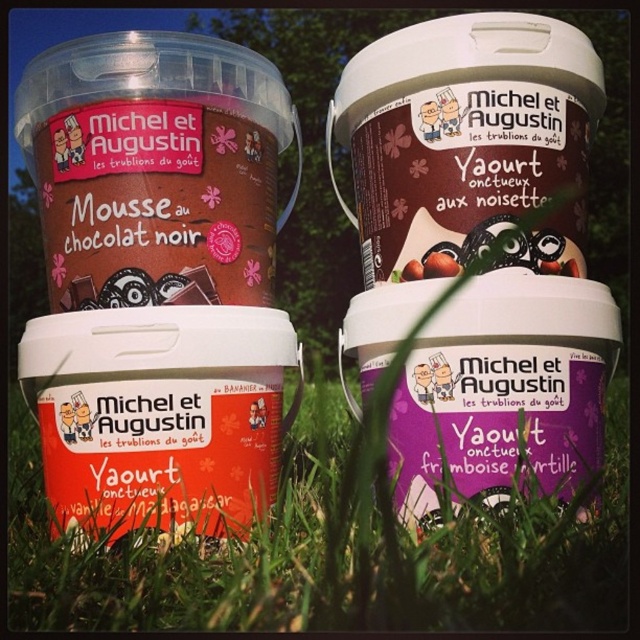
Can you confirm if green grass at lower center is positioned to the right of matte chocolate spread at center?

Incorrect, green grass at lower center is not on the right side of matte chocolate spread at center.

Which is in front, point (237, 609) or point (412, 275)?

Positioned in front is point (237, 609).

The height and width of the screenshot is (640, 640). In order to click on green grass at lower center in this screenshot , I will do `click(186, 548)`.

Can you confirm if purple matte yogurt at center is positioned to the right of green grass at lower center?

Yes, purple matte yogurt at center is to the right of green grass at lower center.

Does purple matte yogurt at center appear under green grass at lower center?

No, purple matte yogurt at center is not below green grass at lower center.

Who is more forward, (x=513, y=32) or (x=563, y=557)?

Point (x=563, y=557)

Where is `purple matte yogurt at center`? This screenshot has width=640, height=640. purple matte yogurt at center is located at coordinates (476, 248).

Is purple matte yogurt at center wider than matte chocolate spread at center?

Yes.

Does purple matte yogurt at center have a smaller size compared to matte chocolate spread at center?

No, purple matte yogurt at center is not smaller than matte chocolate spread at center.

Between point (544, 442) and point (419, 250), which one is positioned behind?

Positioned behind is point (419, 250).

This screenshot has height=640, width=640. What are the coordinates of `purple matte yogurt at center` in the screenshot? It's located at pyautogui.click(x=476, y=248).